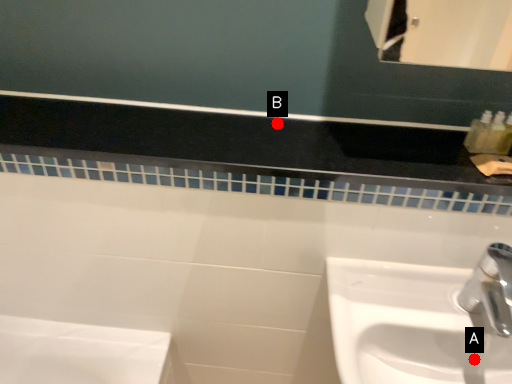
Question: Two points are circled on the image, labeled by A and B beside each circle. Which of the following is the closest to the observer?

Choices:
 (A) A is closer
 (B) B is closer

Answer: (A)